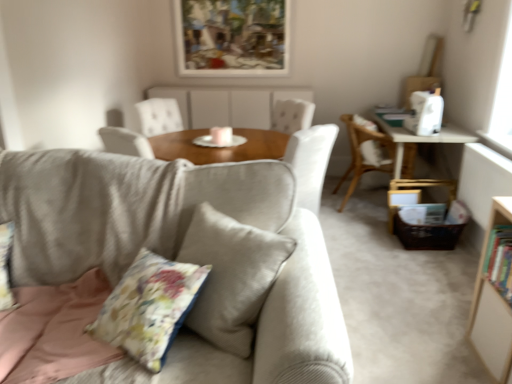
Find the location of a particular element. The image size is (512, 384). matte wood table at center is located at coordinates (228, 105).

Identify the location of floral fabric pillow at center. This screenshot has height=384, width=512. (149, 307).

This screenshot has width=512, height=384. What do you see at coordinates (179, 248) in the screenshot?
I see `light gray fabric couch at center` at bounding box center [179, 248].

Describe the element at coordinates (232, 37) in the screenshot. I see `wooden picture frame at upper center` at that location.

This screenshot has height=384, width=512. Identify the location of wooden chair at right. (365, 154).

Locate an element on the screen. matte wood table at center is located at coordinates (228, 105).

From the image's perspective, which one is positioned lower, wooden picture frame at upper center or matte wood table at center?

From the image's view, matte wood table at center is below.

Does wooden picture frame at upper center have a lesser height compared to matte wood table at center?

No, wooden picture frame at upper center is not shorter than matte wood table at center.

Which is behind, wooden picture frame at upper center or matte wood table at center?

wooden picture frame at upper center.

From a real-world perspective, which object stands above the other?

wooden picture frame at upper center.

From a real-world perspective, is white wood bookcase at right above or below wooden table at right?

white wood bookcase at right is situated higher than wooden table at right in the real world.

Is white wood bookcase at right oriented towards wooden table at right?

No, white wood bookcase at right does not turn towards wooden table at right.

Does white wood bookcase at right have a greater width compared to wooden table at right?

In fact, white wood bookcase at right might be narrower than wooden table at right.

How many degrees apart are the facing directions of white wood bookcase at right and wooden table at right?

The angular difference between white wood bookcase at right and wooden table at right is 1.46 degrees.

Is light gray fabric couch at center situated inside wooden chair at right or outside?

light gray fabric couch at center is outside wooden chair at right.

Is light gray fabric couch at center bigger than wooden chair at right?

Yes, light gray fabric couch at center is bigger than wooden chair at right.

From the image's perspective, is light gray fabric couch at center located beneath wooden chair at right?

Yes, from the image's perspective, light gray fabric couch at center is beneath wooden chair at right.

Based on the photo, which is further, (46, 209) or (412, 168)?

Point (412, 168)

Are wooden picture frame at upper center and wooden chair at right beside each other?

No, wooden picture frame at upper center is not touching wooden chair at right.

Find the location of a particular element. Image resolution: width=512 pixels, height=384 pixels. picture frame above the wooden chair at right (from a real-world perspective) is located at coordinates (232, 37).

Which is correct: wooden picture frame at upper center is inside wooden chair at right, or outside of it?

wooden picture frame at upper center lies outside wooden chair at right.

Is the depth of light gray fabric couch at center greater than that of matte wood table at center?

No, light gray fabric couch at center is in front of matte wood table at center.

From a real-world perspective, who is located lower, light gray fabric couch at center or matte wood table at center?

In real-world perspective, light gray fabric couch at center is lower.

How many degrees apart are the facing directions of light gray fabric couch at center and matte wood table at center?

The angle between the facing direction of light gray fabric couch at center and the facing direction of matte wood table at center is 4.52e-06 degrees.

Is light gray fabric couch at center inside the boundaries of matte wood table at center, or outside?

light gray fabric couch at center lies outside matte wood table at center.

Is wooden chair at right not near floral fabric pillow at center?

Yes, wooden chair at right is far from floral fabric pillow at center.

Does point (346, 176) come in front of point (142, 312)?

That is False.

Consider the image. Considering the sizes of objects wooden chair at right and floral fabric pillow at center in the image provided, who is thinner, wooden chair at right or floral fabric pillow at center?

With smaller width is floral fabric pillow at center.

Does wooden chair at right have a greater height compared to floral fabric pillow at center?

Yes.

Based on the photo, is wooden table at right positioned with its back to matte wood table at center?

No.

Between wooden table at right and matte wood table at center, which one has smaller size?

Smaller between the two is matte wood table at center.

Which object is positioned more to the left, wooden table at right or matte wood table at center?

Positioned to the left is matte wood table at center.

This screenshot has width=512, height=384. Identify the location of beige below the wooden picture frame at upper center (from a real-world perspective). (228, 105).

The image size is (512, 384). What are the coordinates of `table above the white wood bookcase at right (from the image's perspective)` in the screenshot? It's located at (421, 140).

Estimate the real-world distances between objects in this image. Which object is further from hardcover book at right, wooden chair at right or white wood bookcase at right?

Among the two, wooden chair at right is located further to hardcover book at right.

When comparing their distances from hardcover book at right, does wooden table at right or floral fabric pillow at center seem further?

Based on the image, wooden table at right appears to be further to hardcover book at right.

Based on their spatial positions, is floral fabric pillow at center or white wood bookcase at right closer to wooden chair at right?

The object closer to wooden chair at right is white wood bookcase at right.

Looking at the image, which one is located further to wooden table at right, matte wood table at center or white wood bookcase at right?

The object further to wooden table at right is white wood bookcase at right.

Estimate the real-world distances between objects in this image. Which object is closer to matte wood table at center, wooden chair at right or wooden table at right?

wooden chair at right.

Considering their positions, is wooden table at right positioned further to white wood bookcase at right than hardcover book at right?

wooden table at right is further to white wood bookcase at right.

Which object lies further to the anchor point floral fabric pillow at center, light gray fabric couch at center or matte wood table at center?

matte wood table at center is further to floral fabric pillow at center.

Looking at the image, which one is located closer to hardcover book at right, wooden picture frame at upper center or light gray fabric couch at center?

Based on the image, light gray fabric couch at center appears to be nearer to hardcover book at right.

Find the location of a particular element. The height and width of the screenshot is (384, 512). book positioned between white wood bookcase at right and wooden table at right from near to far is located at coordinates (500, 260).

The width and height of the screenshot is (512, 384). In order to click on table between white wood bookcase at right and wooden chair at right from front to back in this screenshot , I will do `click(421, 140)`.

Find the location of a particular element. chair located between wooden picture frame at upper center and wooden table at right in the left-right direction is located at coordinates (365, 154).

At what (x,y) coordinates should I click in order to perform the action: click on table between light gray fabric couch at center and wooden chair at right from front to back. Please return your answer as a coordinate pair (x, y). The image size is (512, 384). Looking at the image, I should click on [421, 140].